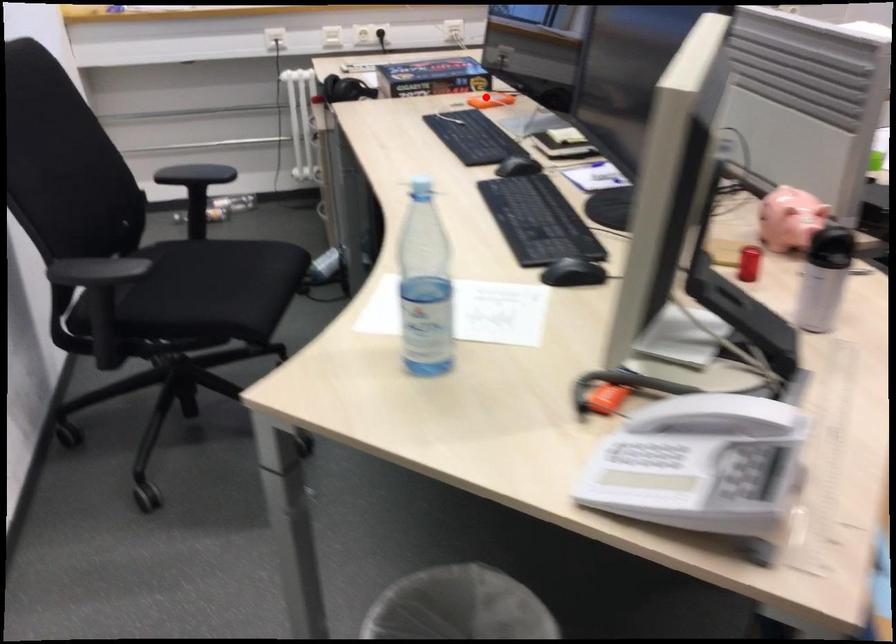
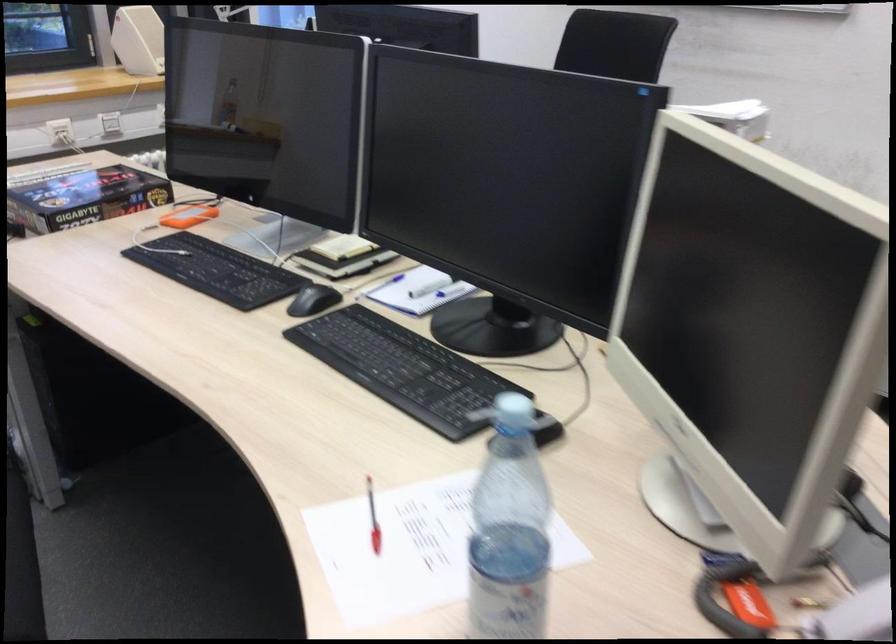
Find the pixel in the second image that matches the highlighted location in the first image.

(188, 216)